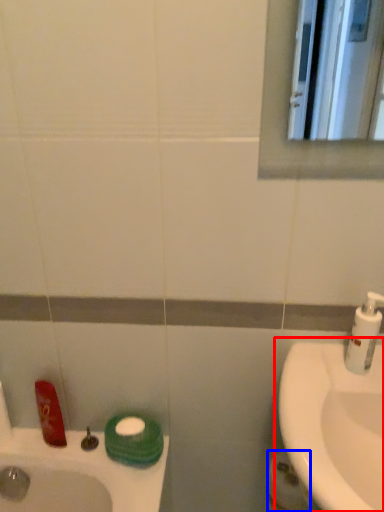
Question: Among these objects, which one is nearest to the camera, sink (highlighted by a red box) or toilet paper (highlighted by a blue box)?

Choices:
 (A) sink
 (B) toilet paper

Answer: (A)